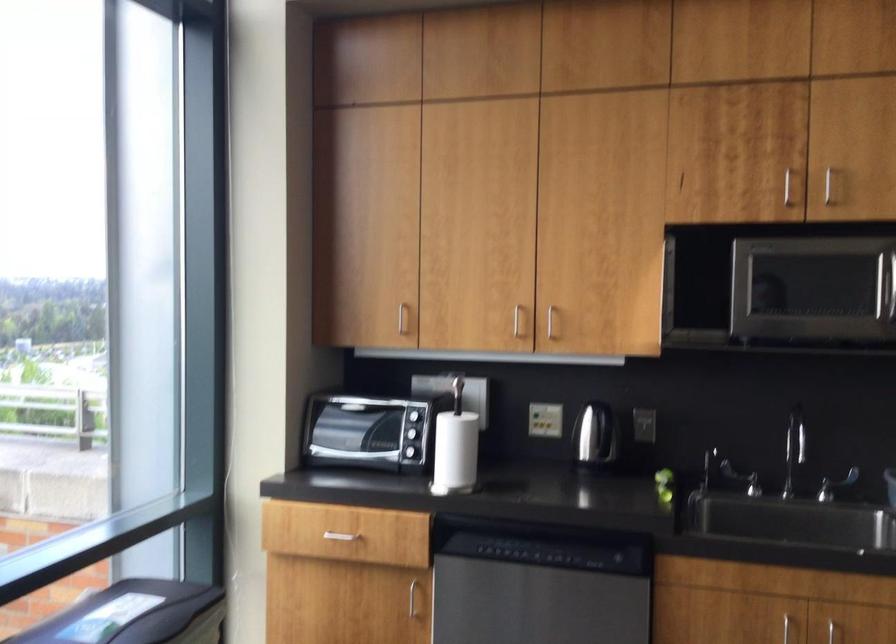
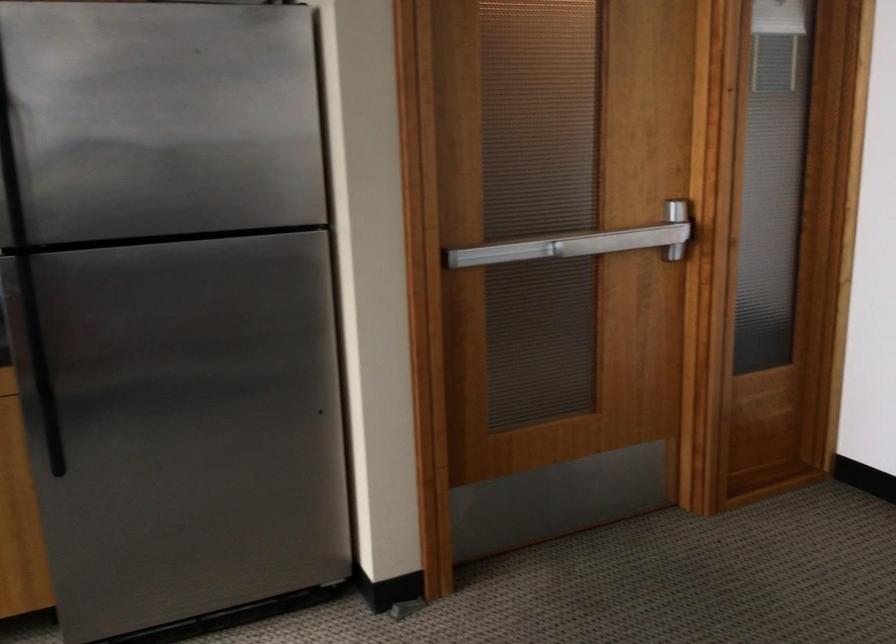
Question: How did the camera likely rotate?

Choices:
 (A) Left
 (B) Right
 (C) Up
 (D) Down

Answer: (B)